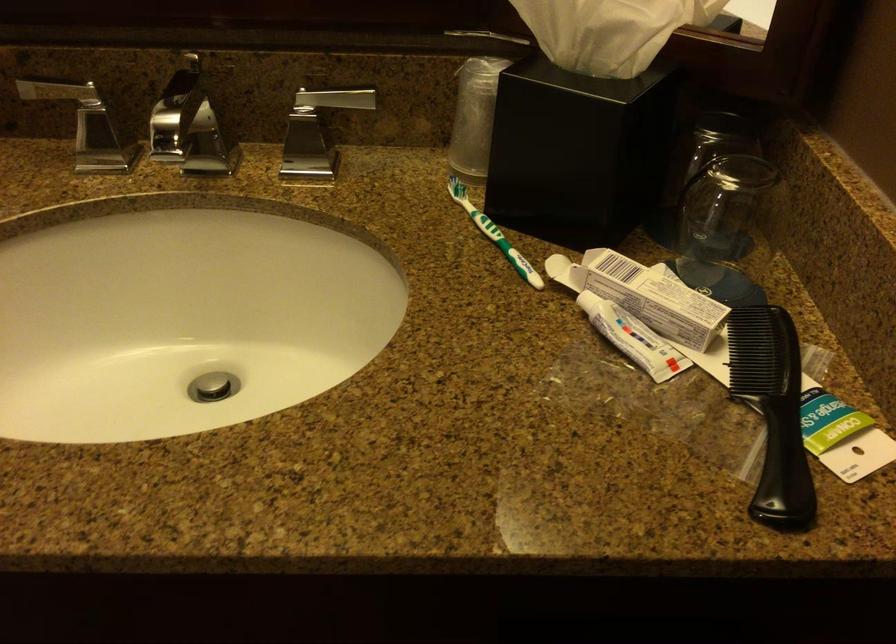
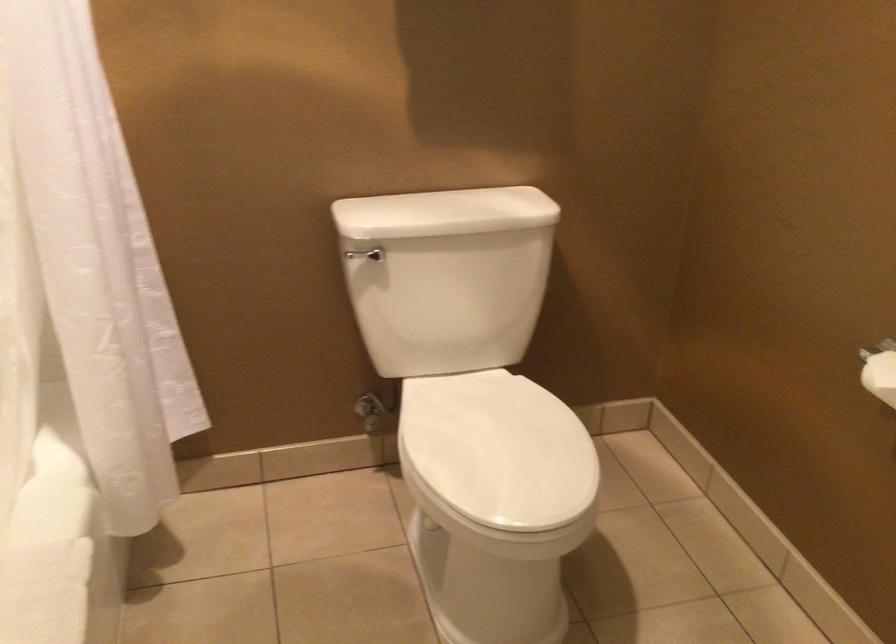
Question: How did the camera likely rotate?

Choices:
 (A) Left
 (B) Right
 (C) Up
 (D) Down

Answer: (A)